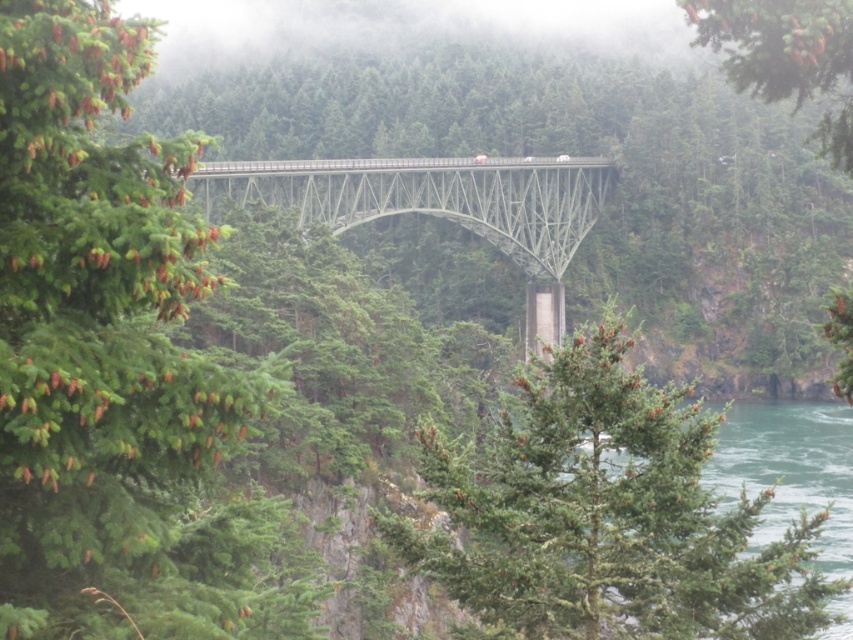
Question: Which object is closer to the camera taking this photo?

Choices:
 (A) green matte tree at upper left
 (B) green water at lower right
 (C) green metallic bridge at center

Answer: (A)

Question: Which of these objects is positioned farthest from the green matte tree at center?

Choices:
 (A) green water at lower right
 (B) green matte tree at upper left
 (C) green matte tree at upper center

Answer: (C)

Question: Is green metallic bridge at center behind green matte tree at upper center?

Choices:
 (A) yes
 (B) no

Answer: (B)

Question: Which of these objects is positioned closest to the green metallic bridge at center?

Choices:
 (A) green water at lower right
 (B) green matte tree at upper left
 (C) green matte tree at upper center
 (D) green matte tree at center

Answer: (B)

Question: Can you confirm if green matte tree at center is positioned above green matte tree at upper center?

Choices:
 (A) yes
 (B) no

Answer: (B)

Question: Can you confirm if green water at lower right is thinner than green matte tree at upper center?

Choices:
 (A) no
 (B) yes

Answer: (A)